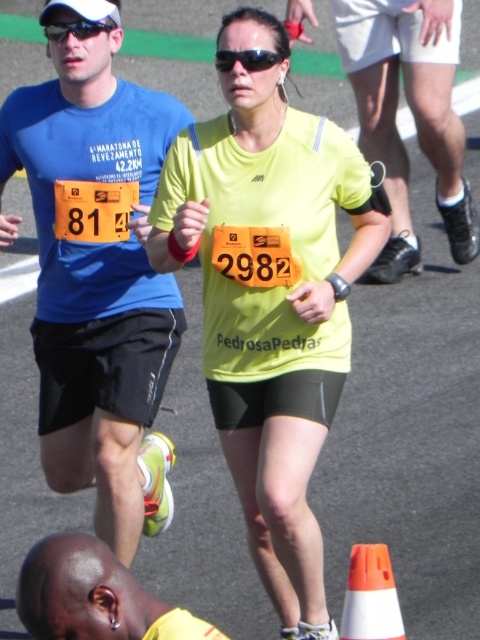
Who is more forward, (467,244) or (111,573)?

Point (111,573) is more forward.

Is matte yellow shorts at center positioned in front of shiny yellow shirt at lower left?

No, matte yellow shorts at center is further to the viewer.

The image size is (480, 640). What do you see at coordinates (412, 115) in the screenshot? I see `matte yellow shorts at center` at bounding box center [412, 115].

Locate an element on the screen. The height and width of the screenshot is (640, 480). matte yellow shorts at center is located at coordinates coord(412,115).

Measure the distance between point (396,618) and camera.

Point (396,618) and camera are 4.10 meters apart from each other.

Does point (365, 582) lie behind point (229, 68)?

No, (365, 582) is in front of (229, 68).

Who is more forward, [348,609] or [257,49]?

Point [257,49]

This screenshot has height=640, width=480. Identify the location of white plastic traffic cone at lower center. 371,596.

Does yellow matte shirt at center come in front of black matte sunglasses at center?

That is True.

Who is taller, yellow matte shirt at center or black matte sunglasses at center?

With more height is yellow matte shirt at center.

Does point (275, 244) come farther from viewer compared to point (259, 70)?

Yes, point (275, 244) is behind point (259, 70).

Where is `yellow matte shirt at center`? This screenshot has height=640, width=480. yellow matte shirt at center is located at coordinates (269, 298).